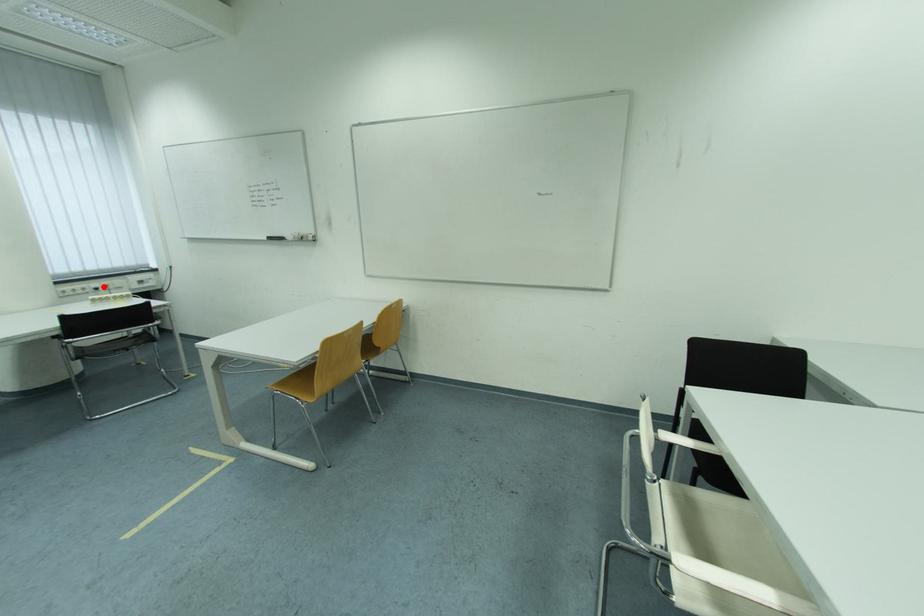
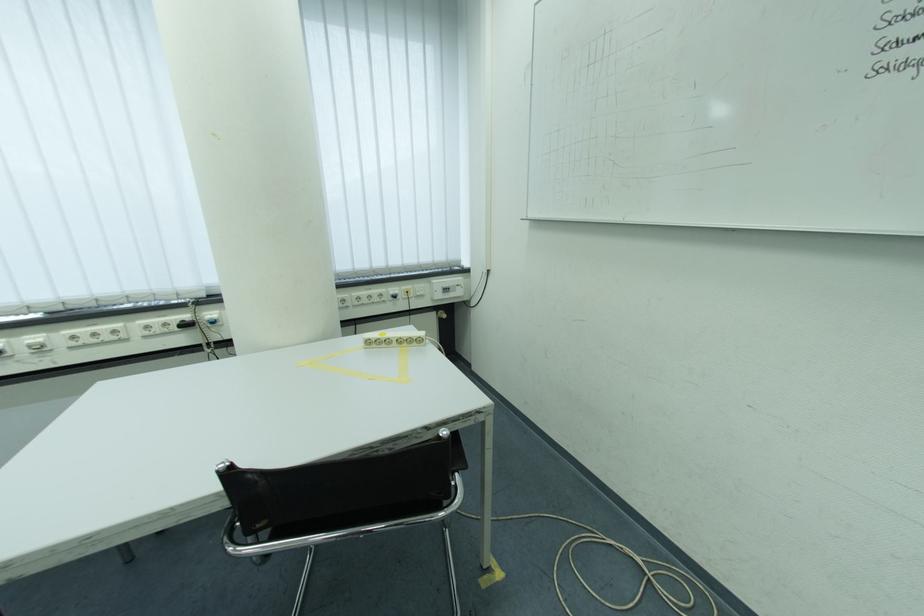
Question: A red point is marked in image1. In image2, is the corresponding 3D point closer to the camera or farther? Reply with the corresponding letter.

Choices:
 (A) The corresponding 3D point is closer.
 (B) The corresponding 3D point is farther.

Answer: (A)